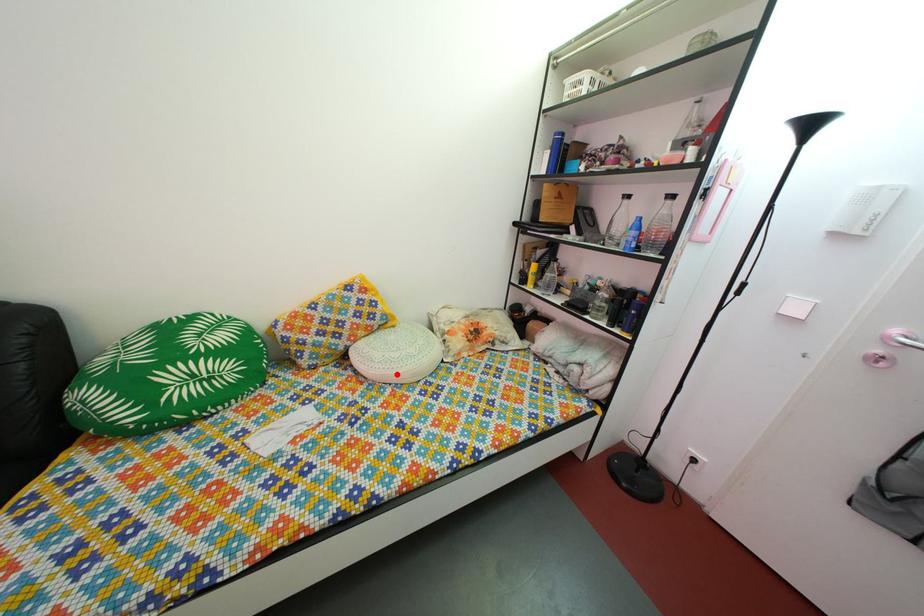
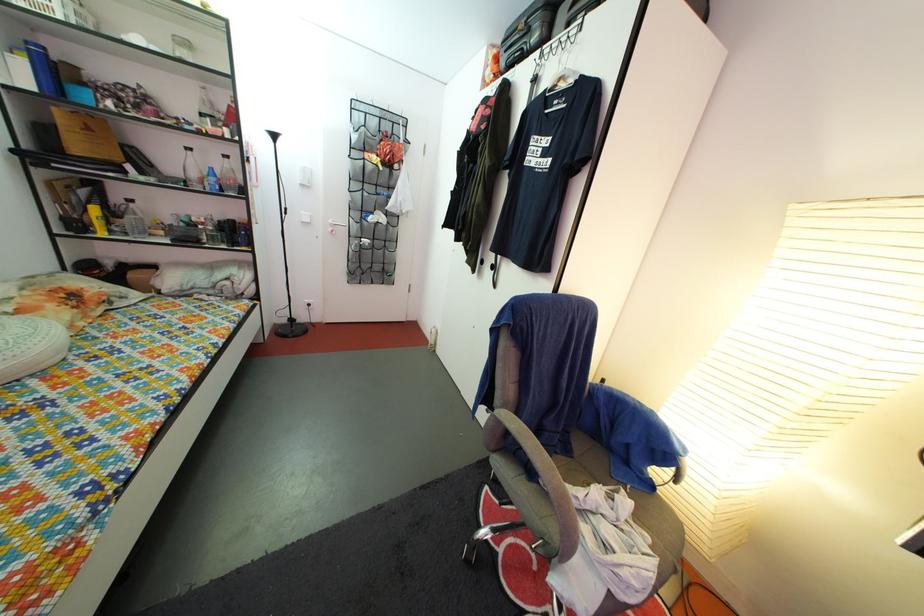
In the second image, find the point that corresponds to the highlighted location in the first image.

(9, 366)